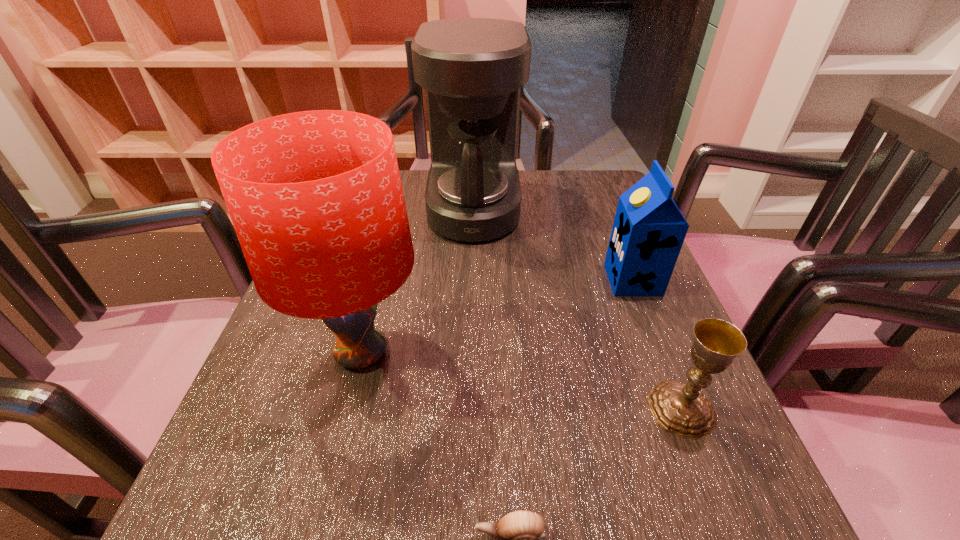
Locate an element on the screen. vacant space located 0.090m on the left of the chalice is located at coordinates (590, 409).

This screenshot has width=960, height=540. In order to click on object at the far edge in this screenshot , I will do `click(472, 69)`.

The width and height of the screenshot is (960, 540). I want to click on object that is at the left edge, so click(315, 197).

Where is `carton that is positioned at the right edge`? This screenshot has height=540, width=960. carton that is positioned at the right edge is located at coordinates (648, 232).

Where is `chalice that is positioned at the right edge`? The width and height of the screenshot is (960, 540). chalice that is positioned at the right edge is located at coordinates (679, 408).

This screenshot has height=540, width=960. In the image, there is a desktop. Identify the location of free region at the far edge. (411, 212).

Where is `free space at the left edge of the desktop`? The image size is (960, 540). free space at the left edge of the desktop is located at coordinates (308, 417).

The image size is (960, 540). I want to click on vacant space at the right edge of the desktop, so click(598, 231).

Find the location of a particular element. This screenshot has height=540, width=960. vacant point at the far right corner is located at coordinates (601, 201).

I want to click on free point between the lampshade and the coffee maker, so (x=418, y=281).